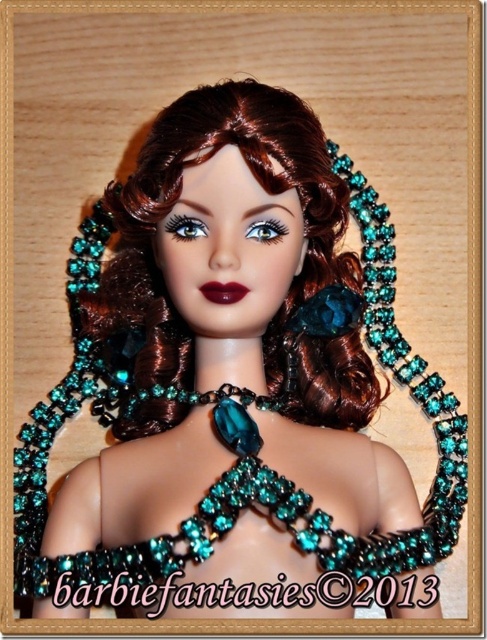
You are taking a photo of the doll and need to focus on either the point at point (357, 282) or the point at point (225, 470). Which point should you focus on to ensure the foreground is sharp?

You should focus on point (357, 282) because it is closer to the camera than point (225, 470), ensuring the foreground remains sharp.

You are an artist trying to sketch this doll. The shiny brown hair at center is located at point 0.309, 0.368. If you want to place a highlight on the hair, where should you place it?

You should place the highlight on the shiny brown hair at center at point (x=179, y=196).

You are a stylist preparing to take a photo of the doll. You need to ensure that the teal beaded necklace at center is visible in the frame. Given that the shiny brown hair at center is in front of the necklace, will the necklace still be mostly visible?

The shiny brown hair at center has a lesser width compared to the teal beaded necklace at center, so the necklace will still be mostly visible since the hair is narrower and less likely to fully obscure it.